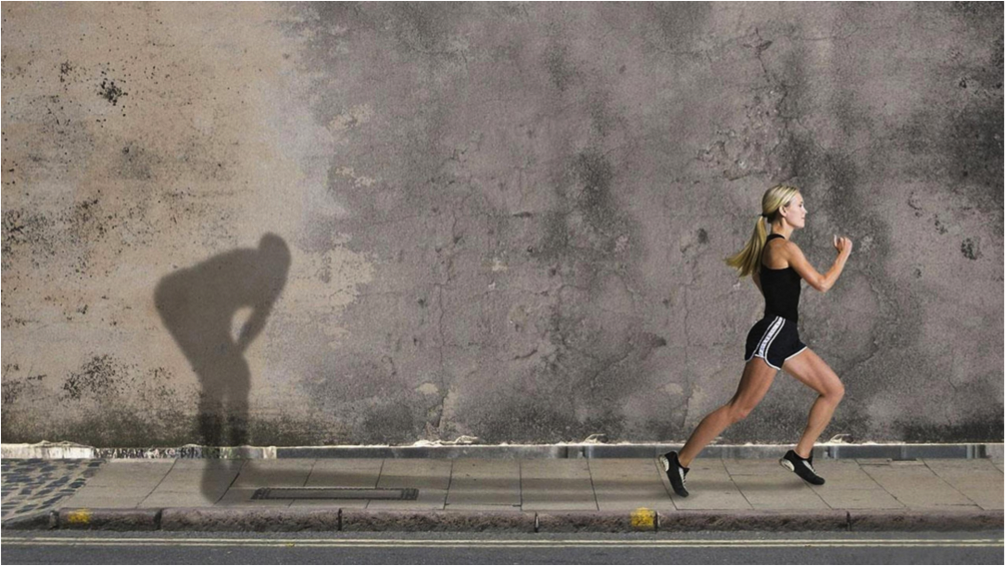
Locate an element on the screen. cream wall is located at coordinates (165, 113), (37, 297).